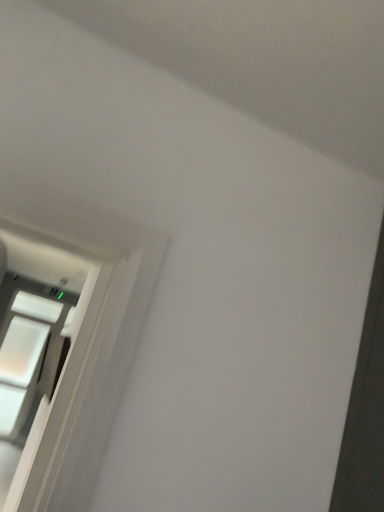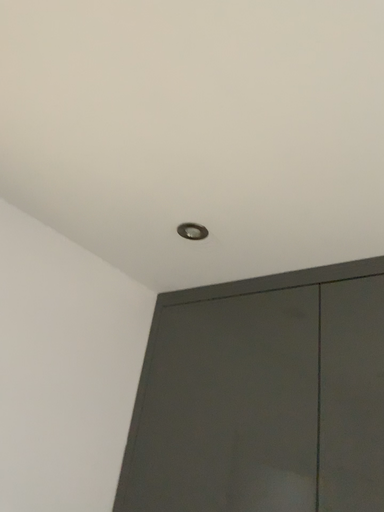
Question: Which way did the camera rotate in the video?

Choices:
 (A) rotated right
 (B) rotated left

Answer: (A)